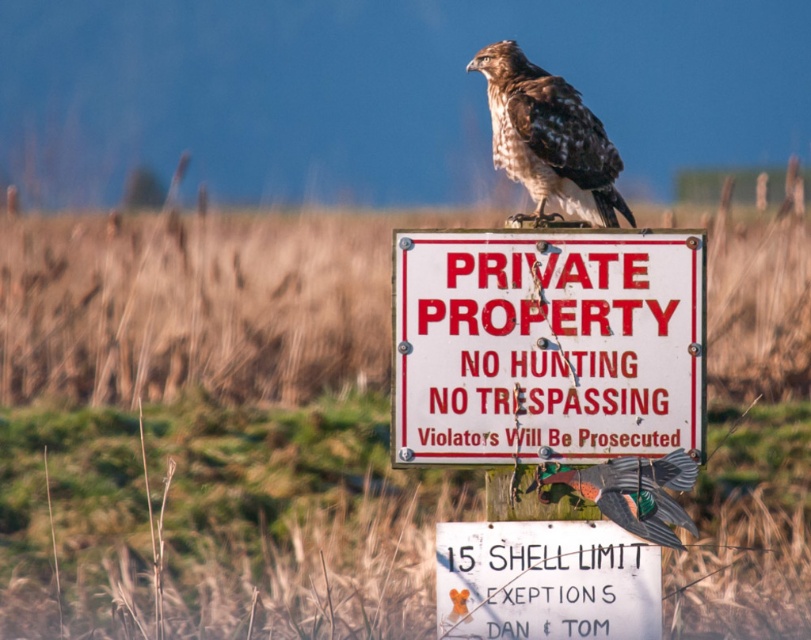
You are a park ranger checking the signs on the brown wooden sign at center and the white painted metal sign at center. Which sign is placed higher?

The brown wooden sign at center is positioned over the white painted metal sign at center, so the brown wooden sign at center is higher.

You are a birdwatcher trying to observe the hawk perched on the sign. Which sign should you focus on to see the hawk better, the brown wooden sign at center or the white painted metal sign at center?

The brown wooden sign at center is taller than the white painted metal sign at center, so focusing on the brown wooden sign at center will provide a better view of the hawk since it is higher up.